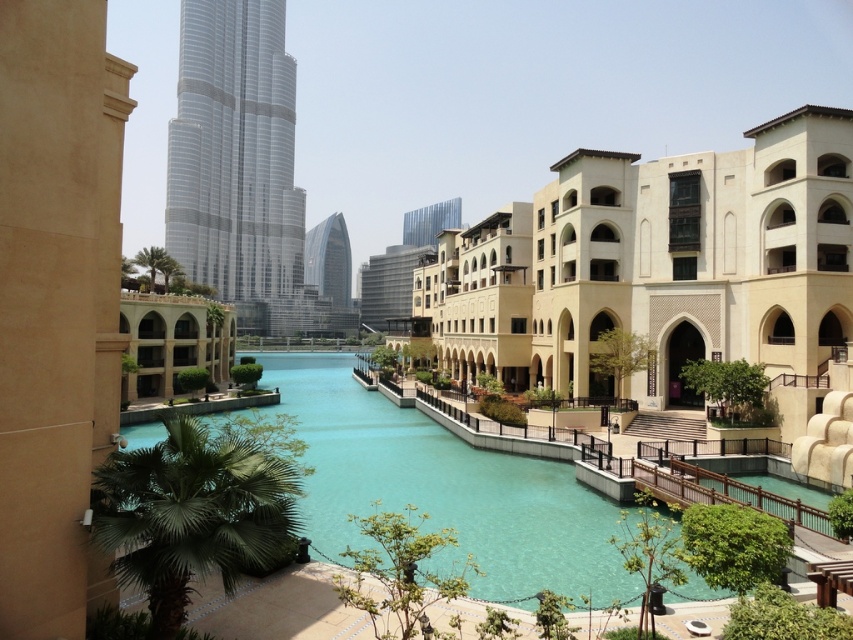
You are standing on the walkway next to the turquoise waterway and want to take a photo of both the beige stone building at center and the green leafy palm tree at upper center. Which object should you position to your left side to include both in the frame?

To include both the beige stone building at center and the green leafy palm tree at upper center in your photo, position the green leafy palm tree at upper center to your left side since the beige stone building at center is to the right of it.

You are an architect designing a new park in the city. You want to place a new statue exactly between the glassy silver tower at center and the green leafy palm tree at upper center. Based on the image, which direction should the statue face to be equidistant from both structures?

The statue should face towards the left since the glassy silver tower at center is positioned on the right side of the green leafy palm tree at upper center, meaning the midpoint between them would be to the left of the tower and right of the palm tree.